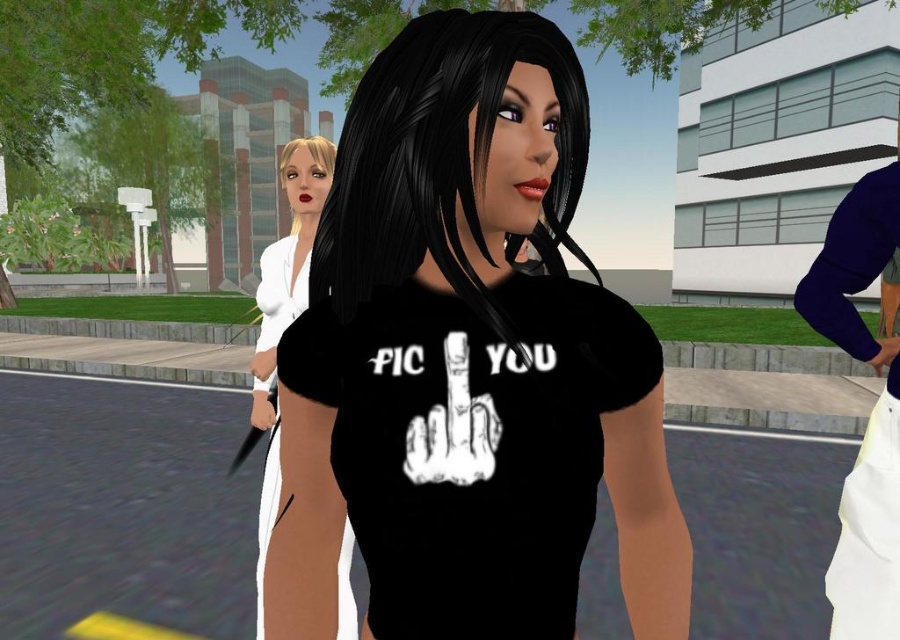
Looking at this image, is white matte dress at center to the right of blondehair at center from the viewer's perspective?

Correct, you'll find white matte dress at center to the right of blondehair at center.

This screenshot has height=640, width=900. Describe the element at coordinates (284, 310) in the screenshot. I see `white matte dress at center` at that location.

Is point (320, 196) behind point (282, 156)?

No, it is in front of (282, 156).

The height and width of the screenshot is (640, 900). In order to click on white matte dress at center in this screenshot , I will do click(x=284, y=310).

Can you confirm if black matte t-shirt at center is thinner than black matte hair at center?

Yes, black matte t-shirt at center is thinner than black matte hair at center.

Which is below, black matte t-shirt at center or black matte hair at center?

black matte t-shirt at center is lower down.

Where is `black matte t-shirt at center`? black matte t-shirt at center is located at coordinates (468, 362).

Looking at this image, does black matte t-shirt at center have a larger size compared to blondehair at center?

Incorrect, black matte t-shirt at center is not larger than blondehair at center.

Consider the image. Is black matte t-shirt at center to the left of blondehair at center from the viewer's perspective?

No, black matte t-shirt at center is not to the left of blondehair at center.

Who is more distant from viewer, (280, 500) or (324, 157)?

Answer: Positioned behind is point (324, 157).

At what (x,y) coordinates should I click in order to perform the action: click on black matte t-shirt at center. Please return your answer as a coordinate pair (x, y). This screenshot has width=900, height=640. Looking at the image, I should click on (468, 362).